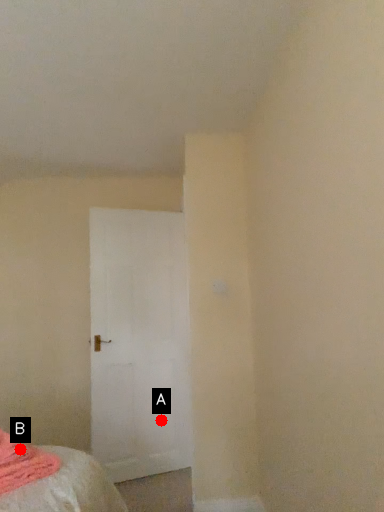
Question: Two points are circled on the image, labeled by A and B beside each circle. Which of the following is the farthest from the observer?

Choices:
 (A) A is further
 (B) B is further

Answer: (A)